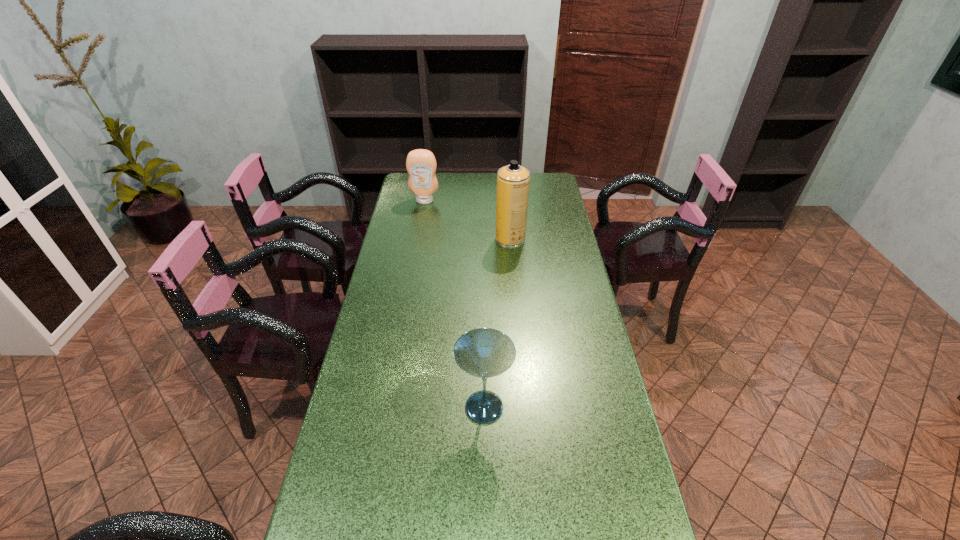
Identify the location of aerosol can. (513, 180).

This screenshot has width=960, height=540. What are the coordinates of `the tallest object` in the screenshot? It's located at (513, 180).

Identify the location of the leftmost object. The width and height of the screenshot is (960, 540). (421, 164).

You are a GUI agent. You are given a task and a screenshot of the screen. Output one action in this format:
    pyautogui.click(x=<x>, y=<y>)
    Task: Click on the condiment
    
    Given the screenshot: What is the action you would take?
    pyautogui.click(x=421, y=164)

This screenshot has width=960, height=540. Find the location of `martini`. martini is located at coordinates (483, 352).

Identify the location of free region located 0.240m on the back of the second farthest object. (507, 200).

At what (x,y) coordinates should I click in order to perform the action: click on free spot located 0.050m on the label of the condiment. Please return your answer as a coordinate pair (x, y). Image resolution: width=960 pixels, height=540 pixels. Looking at the image, I should click on (422, 211).

The height and width of the screenshot is (540, 960). In order to click on vacant space located on the back of the nearest object in this screenshot , I will do `click(483, 297)`.

Locate an element on the screen. The image size is (960, 540). object that is at the far edge is located at coordinates (421, 164).

Image resolution: width=960 pixels, height=540 pixels. Find the location of `object that is at the left edge`. object that is at the left edge is located at coordinates (421, 164).